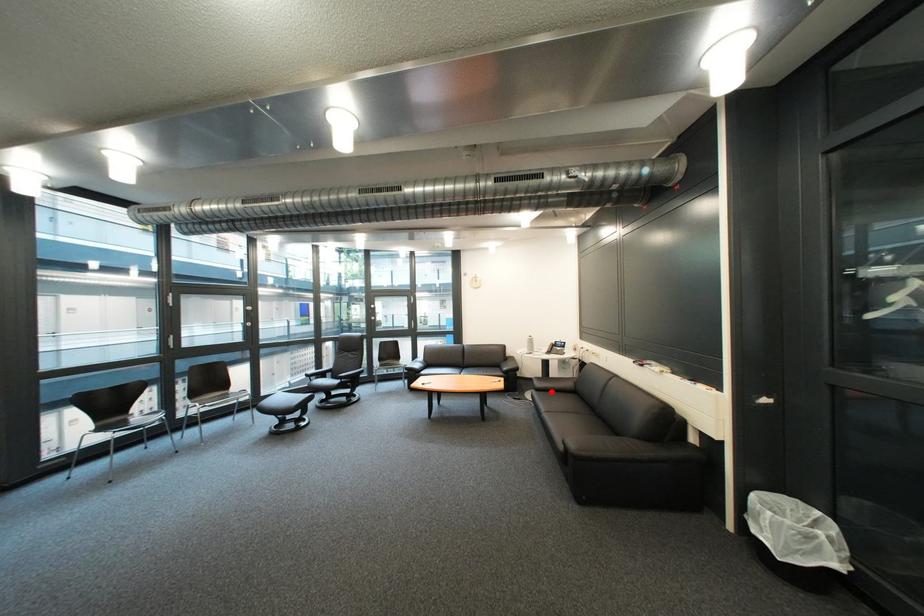
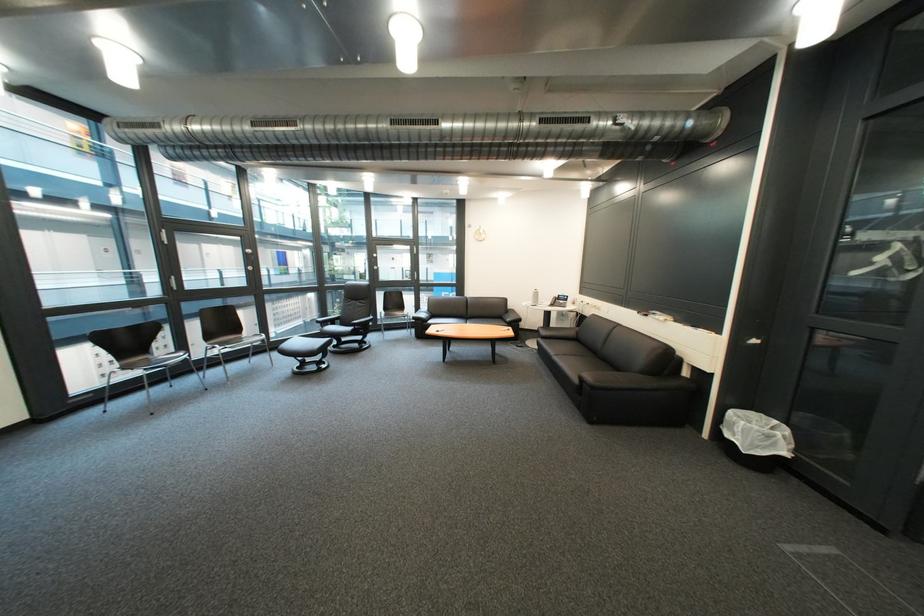
In the second image, find the point that corresponds to the highlighted location in the first image.

(556, 339)